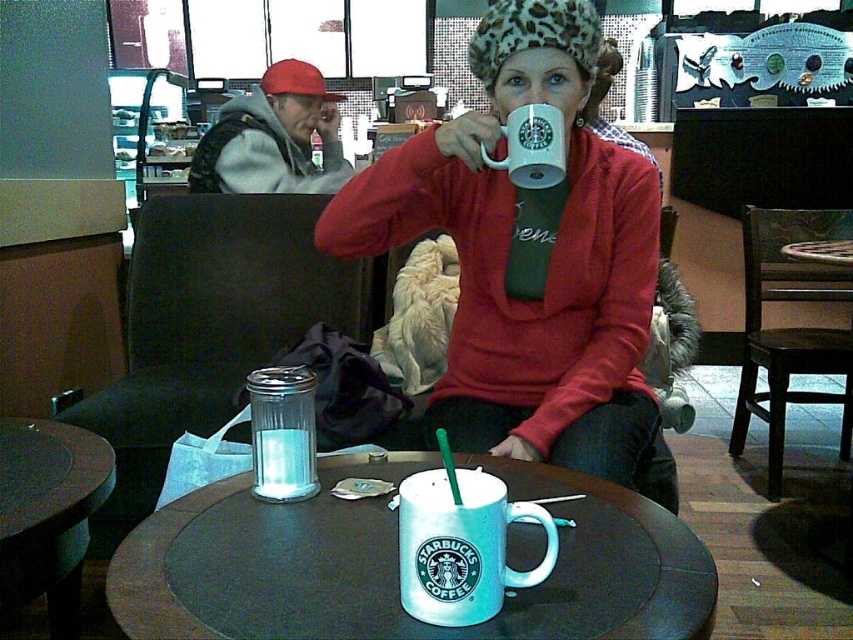
Does smooth dark wood table at lower left appear on the left side of clear plastic shaker at center?

Correct, you'll find smooth dark wood table at lower left to the left of clear plastic shaker at center.

Can you confirm if smooth dark wood table at lower left is positioned above clear plastic shaker at center?

Actually, smooth dark wood table at lower left is below clear plastic shaker at center.

Describe the element at coordinates (48, 513) in the screenshot. I see `smooth dark wood table at lower left` at that location.

This screenshot has width=853, height=640. In order to click on smooth dark wood table at lower left in this screenshot , I will do `click(48, 513)`.

Does matte white mug at center appear over clear plastic shaker at center?

Indeed, matte white mug at center is positioned over clear plastic shaker at center.

Is matte white mug at center positioned before clear plastic shaker at center?

No, matte white mug at center is behind clear plastic shaker at center.

This screenshot has height=640, width=853. What do you see at coordinates (531, 260) in the screenshot?
I see `matte white mug at center` at bounding box center [531, 260].

Identify the location of matte white mug at center. The height and width of the screenshot is (640, 853). (531, 260).

Who is positioned more to the left, metallic silver cup at center or matte gray hoodie at upper left?

matte gray hoodie at upper left

Is metallic silver cup at center shorter than matte gray hoodie at upper left?

Indeed, metallic silver cup at center has a lesser height compared to matte gray hoodie at upper left.

Is point (639, 520) farther from camera compared to point (297, 88)?

No, (639, 520) is in front of (297, 88).

Image resolution: width=853 pixels, height=640 pixels. I want to click on metallic silver cup at center, so click(x=396, y=564).